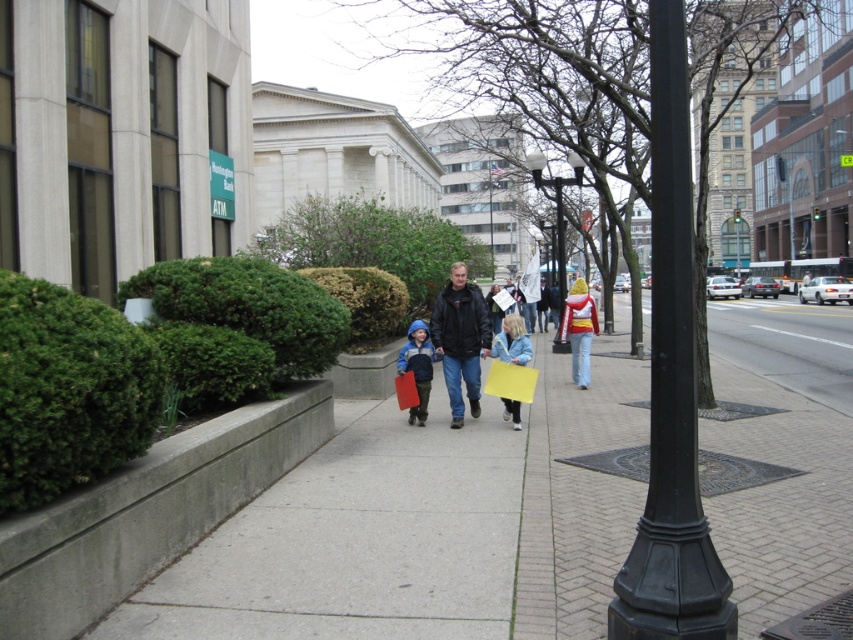
Can you confirm if concrete sidewalk at center is positioned to the right of black leather jacket at center?

Yes, concrete sidewalk at center is to the right of black leather jacket at center.

Where is `concrete sidewalk at center`? Image resolution: width=853 pixels, height=640 pixels. concrete sidewalk at center is located at coordinates (422, 525).

Is point (576, 609) farther from viewer compared to point (444, 348)?

That is False.

You are a GUI agent. You are given a task and a screenshot of the screen. Output one action in this format:
    pyautogui.click(x=<x>, y=<y>)
    Task: Click on the concrete sidewalk at center
    Image resolution: width=853 pixels, height=640 pixels.
    Given the screenshot: What is the action you would take?
    pyautogui.click(x=422, y=525)

Can you confirm if yellow knit hat at center is positioned above matte blue jacket at center?

Yes, yellow knit hat at center is above matte blue jacket at center.

Which of these two, yellow knit hat at center or matte blue jacket at center, stands taller?

matte blue jacket at center is taller.

You are a GUI agent. You are given a task and a screenshot of the screen. Output one action in this format:
    pyautogui.click(x=<x>, y=<y>)
    Task: Click on the yellow knit hat at center
    The height and width of the screenshot is (640, 853).
    Given the screenshot: What is the action you would take?
    pyautogui.click(x=579, y=330)

Looking at this image, is black metal pole at center smaller than black metal streetlight at center?

Indeed, black metal pole at center has a smaller size compared to black metal streetlight at center.

Find the location of a particular element. This screenshot has height=640, width=853. black metal pole at center is located at coordinates (671, 388).

Find the location of a particular element. black metal pole at center is located at coordinates (671, 388).